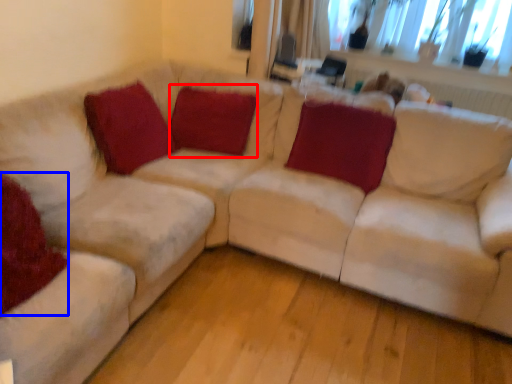
Question: Which of the following is the farthest to the observer, pillow (highlighted by a red box) or pillow (highlighted by a blue box)?

Choices:
 (A) pillow
 (B) pillow

Answer: (A)